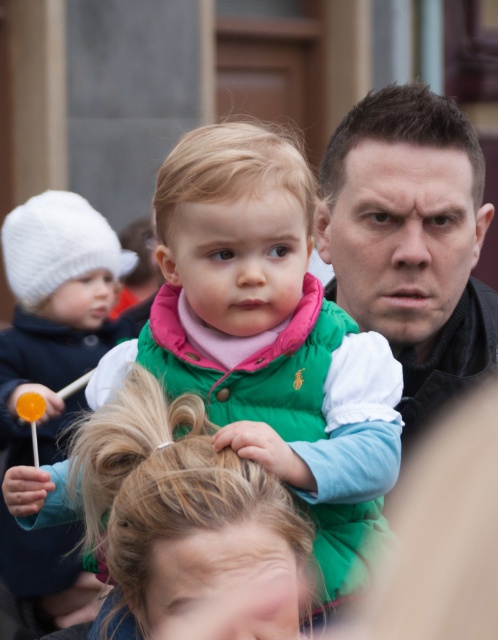
Locate an element on the screen. green down jacket at center is located at coordinates (269, 333).

The height and width of the screenshot is (640, 498). Identify the location of green down jacket at center. (269, 333).

Who is more distant from viewer, (375, 362) or (10, 364)?

The point (10, 364) is more distant.

Between green down jacket at center and white knitted hat at left, which one appears on the right side from the viewer's perspective?

Positioned to the right is green down jacket at center.

Does point (303, 435) come in front of point (32, 268)?

Yes, point (303, 435) is in front of point (32, 268).

You are a GUI agent. You are given a task and a screenshot of the screen. Output one action in this format:
    pyautogui.click(x=<x>, y=<y>)
    Task: Click on the green down jacket at center
    The image size is (498, 640).
    Given the screenshot: What is the action you would take?
    pyautogui.click(x=269, y=333)

Is point (361, 246) less distant than point (50, 397)?

Yes, it is in front of point (50, 397).

Between matte black jacket at center and white knitted hat at left, which one appears on the right side from the viewer's perspective?

From the viewer's perspective, matte black jacket at center appears more on the right side.

Locate an element on the screen. Image resolution: width=498 pixels, height=640 pixels. matte black jacket at center is located at coordinates click(x=410, y=241).